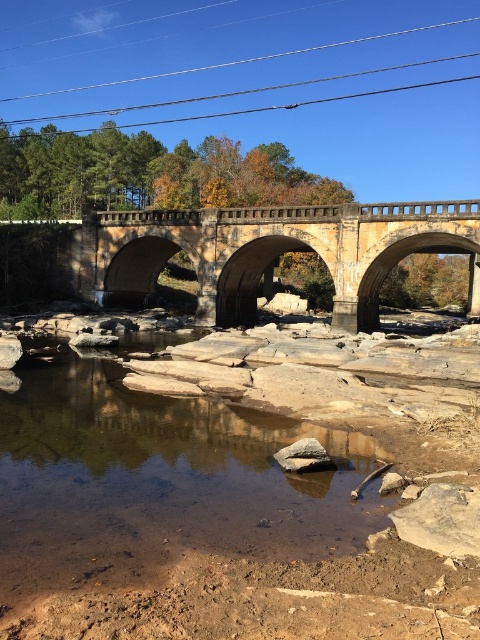
You are a photographer planning to capture the stone bridge and its surroundings. You notice the metallic wire at upper center and the gray rough rock at center in your viewfinder. Which object should you adjust your camera angle to focus on if you want to highlight the one that is taller?

The metallic wire at upper center is taller than the gray rough rock at center, so you should adjust your camera angle to focus on the metallic wire at upper center to highlight its height.